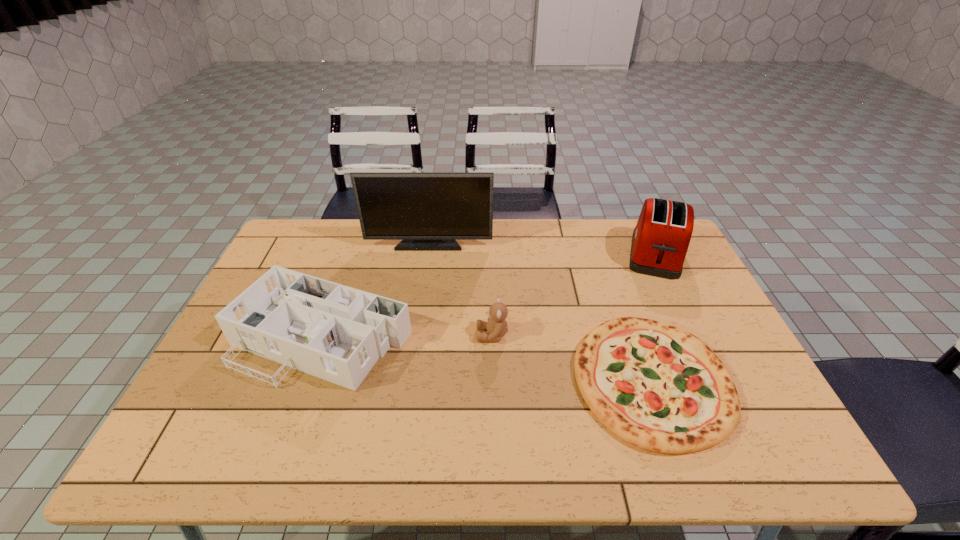
Identify the location of free region at the far edge of the desktop. The image size is (960, 540). (357, 251).

In the image, there is a desktop. Where is `vacant space at the near edge`? The width and height of the screenshot is (960, 540). vacant space at the near edge is located at coordinates (386, 445).

Locate an element on the screen. This screenshot has width=960, height=540. free space at the left edge is located at coordinates (315, 265).

In the image, there is a desktop. Identify the location of vacant space at the right edge. (706, 336).

Where is `vacant space at the far left corner of the desktop`? vacant space at the far left corner of the desktop is located at coordinates (286, 260).

Where is `vacant region at the near left corner of the desktop`? This screenshot has height=540, width=960. vacant region at the near left corner of the desktop is located at coordinates (217, 449).

The width and height of the screenshot is (960, 540). I want to click on unoccupied area between the shortest object and the monitor, so click(540, 312).

Where is `free space between the teddy bear and the toaster`? Image resolution: width=960 pixels, height=540 pixels. free space between the teddy bear and the toaster is located at coordinates (574, 295).

The image size is (960, 540). I want to click on vacant area between the dollhouse and the monitor, so click(376, 290).

Image resolution: width=960 pixels, height=540 pixels. Find the location of `vacant space in between the second tallest object and the teddy bear`. vacant space in between the second tallest object and the teddy bear is located at coordinates (574, 295).